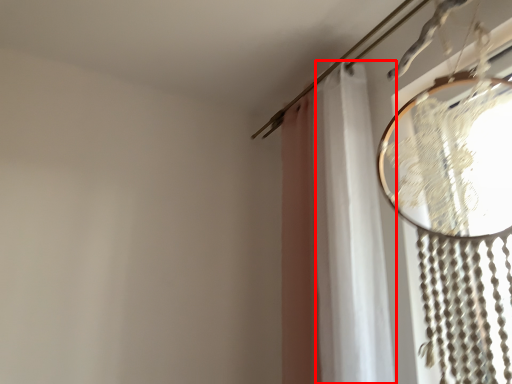
Question: From the image's perspective, what is the correct spatial positioning of shower curtain (annotated by the red box) in reference to curtain?

Choices:
 (A) above
 (B) below

Answer: (B)